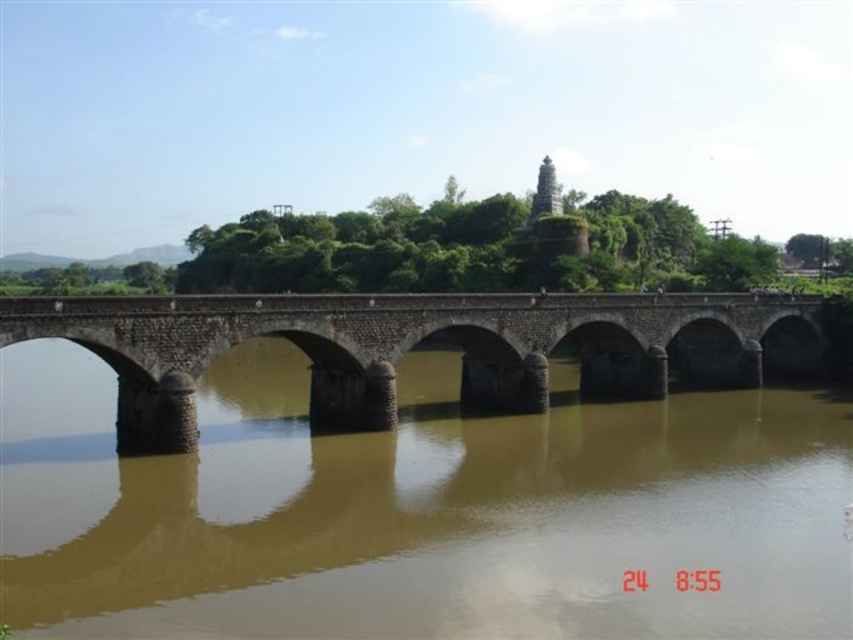
Question: Which object appears closest to the camera in this image?

Choices:
 (A) brown stone river at center
 (B) brown stone bridge at center

Answer: (A)

Question: Is brown stone river at center thinner than brown stone bridge at center?

Choices:
 (A) no
 (B) yes

Answer: (A)

Question: Which object appears closest to the camera in this image?

Choices:
 (A) brown stone river at center
 (B) brown stone bridge at center

Answer: (A)

Question: Is brown stone river at center above brown stone bridge at center?

Choices:
 (A) no
 (B) yes

Answer: (A)

Question: Observing the image, what is the correct spatial positioning of brown stone river at center in reference to brown stone bridge at center?

Choices:
 (A) left
 (B) right

Answer: (A)